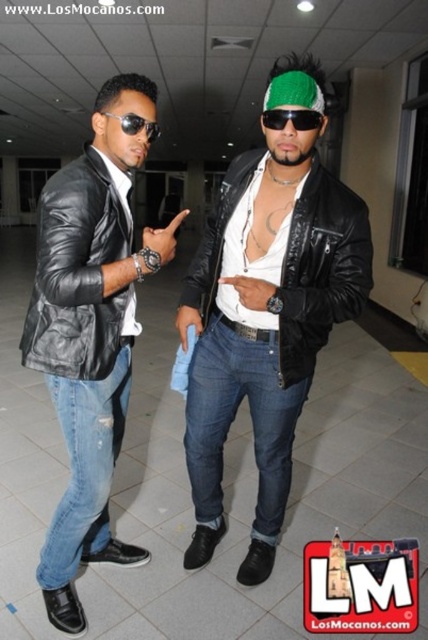
Question: Is ripped denim jeans at left bigger than green knitted cap at upper center?

Choices:
 (A) no
 (B) yes

Answer: (B)

Question: Estimate the real-world distances between objects in this image. Which object is farther from the matte black leather jacket at left?

Choices:
 (A) denim jeans at center
 (B) black leather jacket at left
 (C) matte black leather jacket at center
 (D) ripped denim jeans at left

Answer: (A)

Question: Observing the image, what is the correct spatial positioning of black leather jacket at left in reference to ripped denim jeans at left?

Choices:
 (A) right
 (B) left

Answer: (A)

Question: Estimate the real-world distances between objects in this image. Which object is farther from the black leather jacket at left?

Choices:
 (A) black reflective sunglasses at upper center
 (B) denim jeans at center

Answer: (A)

Question: Is black leather jacket at center smaller than matte black leather jacket at left?

Choices:
 (A) no
 (B) yes

Answer: (A)

Question: Which point is closer to the camera?

Choices:
 (A) black leather jacket at center
 (B) black reflective sunglasses at upper center
 (C) matte black leather jacket at left

Answer: (C)